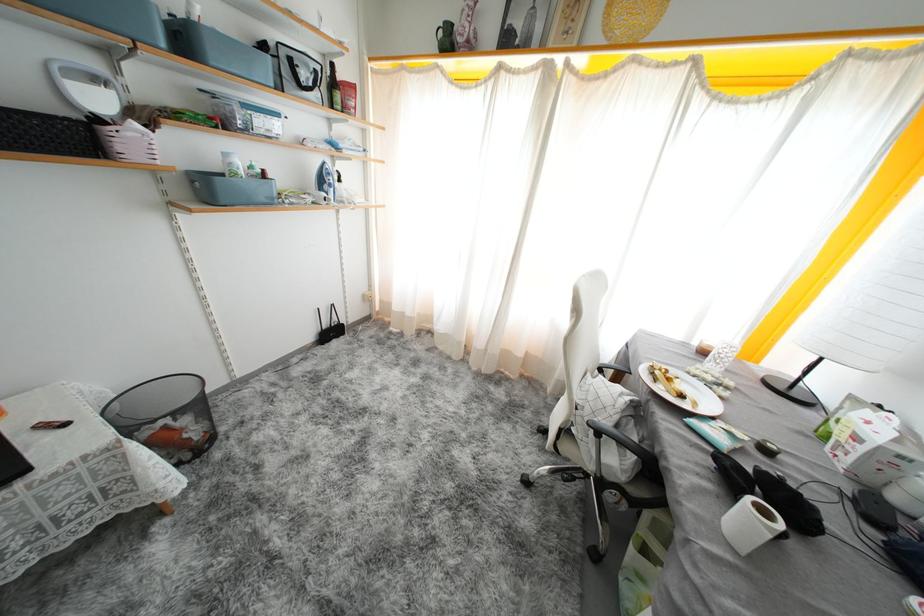
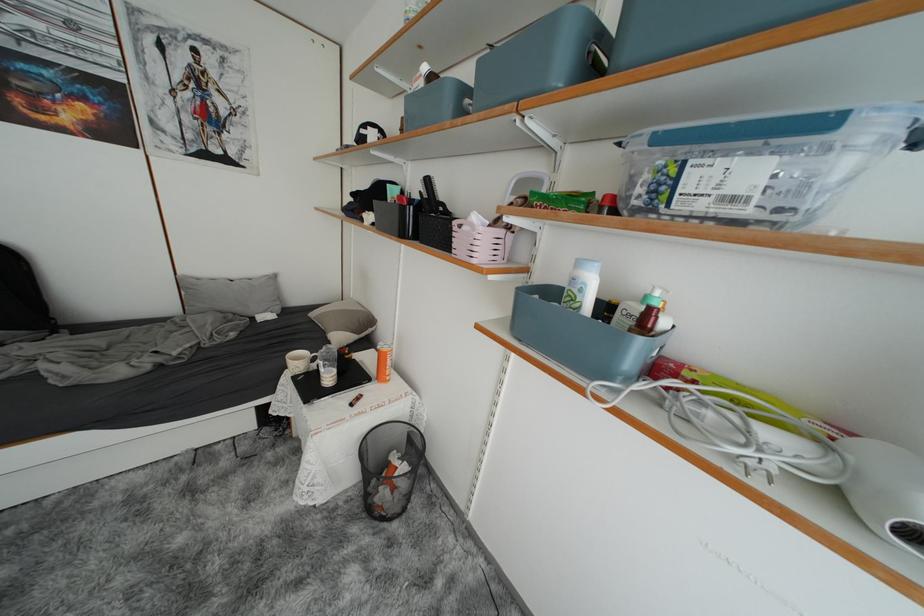
Locate, in the second image, the point that corresponds to point (269, 136) in the first image.

(709, 209)